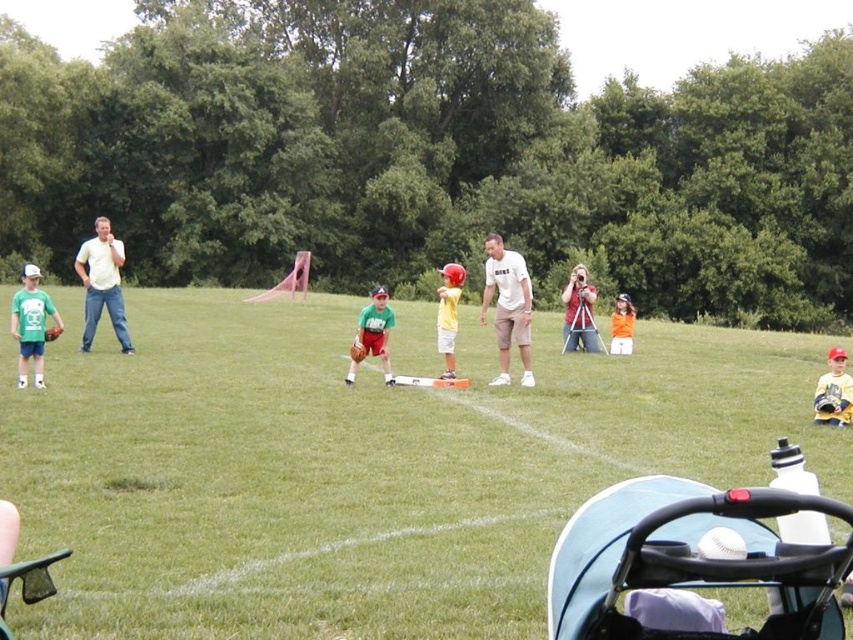
Which is more to the right, matte green t-shirt at left or yellow matte baseball bat at center?

Positioned to the right is yellow matte baseball bat at center.

Does matte green t-shirt at left have a larger size compared to yellow matte baseball bat at center?

Yes.

Which is behind, point (35, 301) or point (445, 323)?

The point (445, 323) is more distant.

At what (x,y) coordinates should I click in order to perform the action: click on matte green t-shirt at left. Please return your answer as a coordinate pair (x, y). Image resolution: width=853 pixels, height=640 pixels. Looking at the image, I should click on (32, 324).

Is point (444, 285) more distant than point (618, 305)?

That is False.

Measure the distance from yellow matte baseball bat at center to orange matte shirt at center.

A distance of 17.77 feet exists between yellow matte baseball bat at center and orange matte shirt at center.

Is point (437, 326) positioned behind point (614, 316)?

That is False.

Find the location of `yellow matte baseball bat at center`. yellow matte baseball bat at center is located at coordinates (448, 314).

Based on the photo, can you confirm if green grass at center is positioned below white cotton shirt at center?

Indeed, green grass at center is positioned under white cotton shirt at center.

At what (x,y) coordinates should I click in order to perform the action: click on green grass at center. Please return your answer as a coordinate pair (x, y). Looking at the image, I should click on (357, 467).

Is point (305, 321) less distant than point (525, 328)?

No, it is not.

Where is `green grass at center`? The height and width of the screenshot is (640, 853). green grass at center is located at coordinates (357, 467).